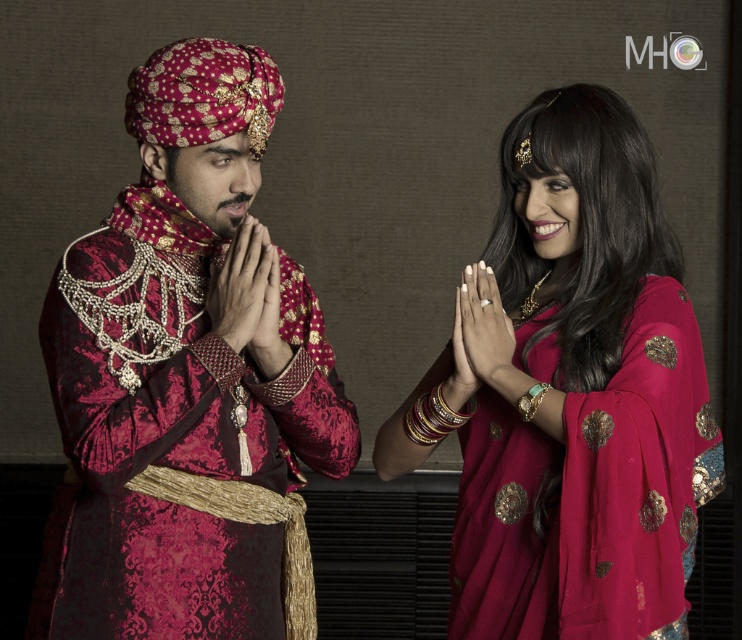
Question: Which is farther from the velvet maroon robe at left?

Choices:
 (A) matte red sari at center
 (B) matte gold hand at center

Answer: (A)

Question: Can you confirm if velvet maroon robe at left is positioned to the left of matte gold ring at center?

Choices:
 (A) no
 (B) yes

Answer: (B)

Question: Which object appears closest to the camera in this image?

Choices:
 (A) matte gold ring at center
 (B) velvet maroon robe at left

Answer: (B)

Question: From the image, what is the correct spatial relationship of matte red sari at center in relation to matte gold hand at center?

Choices:
 (A) right
 (B) left

Answer: (A)

Question: Which of these objects is positioned closest to the matte gold hand at center?

Choices:
 (A) matte gold ring at center
 (B) matte red sari at center
 (C) velvet maroon robe at left

Answer: (C)

Question: Does velvet maroon robe at left lie behind matte red sari at center?

Choices:
 (A) no
 (B) yes

Answer: (A)